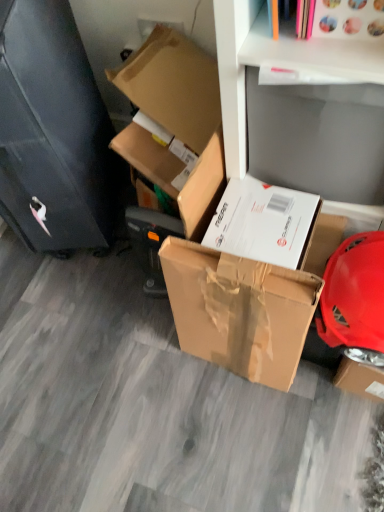
Measure the distance between point [297,68] and camera.

Point [297,68] and camera are 73.10 centimeters apart.

In order to click on black matte file cabinet at left in this screenshot , I will do `click(53, 131)`.

Measure the distance between brown cardboard box at center, which is the 1th box in bottom-to-top order, and camera.

brown cardboard box at center, which is the 1th box in bottom-to-top order, and camera are 30.66 inches apart.

Describe the element at coordinates (177, 119) in the screenshot. I see `brown cardboard box at upper left, positioned as the second box in bottom-to-top order` at that location.

I want to click on white matte shelf at upper center, so click(303, 109).

Are brown cardboard box at upper left, positioned as the second box in bottom-to-top order, and white matte shelf at upper center far apart?

They are positioned close to each other.

Which point is more distant from viewer, (181, 204) or (254, 11)?

Positioned behind is point (181, 204).

Looking at this image, could you tell me if brown cardboard box at upper left, which ranks as the 1th box in top-to-bottom order, is turned towards white matte shelf at upper center?

No, brown cardboard box at upper left, which ranks as the 1th box in top-to-bottom order, is not facing towards white matte shelf at upper center.

Between brown cardboard box at upper left, which ranks as the 1th box in top-to-bottom order, and white matte shelf at upper center, which one has larger size?

brown cardboard box at upper left, which ranks as the 1th box in top-to-bottom order, is bigger.

Is white matte shelf at upper center to the left of brown cardboard box at upper left, which ranks as the 1th box in top-to-bottom order, from the viewer's perspective?

No, white matte shelf at upper center is not to the left of brown cardboard box at upper left, which ranks as the 1th box in top-to-bottom order.

Locate an element on the screen. The image size is (384, 512). the 2nd box counting from the left side of the white matte shelf at upper center is located at coordinates (177, 119).

In the scene shown: Between white matte shelf at upper center and brown cardboard box at upper left, which ranks as the 1th box in top-to-bottom order, which one has smaller width?

Thinner between the two is white matte shelf at upper center.

Between white matte shelf at upper center and brown cardboard box at upper left, which ranks as the 1th box in top-to-bottom order, which one has larger size?

Bigger between the two is brown cardboard box at upper left, which ranks as the 1th box in top-to-bottom order.

Measure the distance from brown cardboard box at center, which is the 1th box in bottom-to-top order, to white matte shelf at upper center.

brown cardboard box at center, which is the 1th box in bottom-to-top order, and white matte shelf at upper center are 11.25 inches apart from each other.

Are brown cardboard box at center, which is the 1th box in bottom-to-top order, and white matte shelf at upper center far apart?

brown cardboard box at center, which is the 1th box in bottom-to-top order, is actually quite close to white matte shelf at upper center.

From the image's perspective, which one is positioned lower, brown cardboard box at center, which is the 1th box in bottom-to-top order, or white matte shelf at upper center?

brown cardboard box at center, which is the 1th box in bottom-to-top order, from the image's perspective.

Looking at this image, is brown cardboard box at center, which is the 1th box in bottom-to-top order, not within white matte shelf at upper center?

Indeed, brown cardboard box at center, which is the 1th box in bottom-to-top order, is completely outside white matte shelf at upper center.

Considering the relative positions of black matte file cabinet at left and brown cardboard box at center, the second box in the top-to-bottom sequence, in the image provided, is black matte file cabinet at left in front of brown cardboard box at center, the second box in the top-to-bottom sequence,?

Yes, the depth of black matte file cabinet at left is less than that of brown cardboard box at center, the second box in the top-to-bottom sequence.

Which of these two, black matte file cabinet at left or brown cardboard box at center, the second box in the top-to-bottom sequence, is smaller?

brown cardboard box at center, the second box in the top-to-bottom sequence.

Who is shorter, black matte file cabinet at left or brown cardboard box at center, which is the 1th box in bottom-to-top order?

brown cardboard box at center, which is the 1th box in bottom-to-top order, is shorter.

Is black matte file cabinet at left positioned with its back to brown cardboard box at center, the second box in the top-to-bottom sequence?

black matte file cabinet at left is not turned away from brown cardboard box at center, the second box in the top-to-bottom sequence.

Which object is thinner, brown cardboard box at upper left, positioned as the second box in bottom-to-top order, or black matte file cabinet at left?

With smaller width is black matte file cabinet at left.

Based on the photo, is brown cardboard box at upper left, positioned as the second box in bottom-to-top order, touching black matte file cabinet at left?

No.

Is brown cardboard box at upper left, positioned as the second box in bottom-to-top order, inside the boundaries of black matte file cabinet at left, or outside?

brown cardboard box at upper left, positioned as the second box in bottom-to-top order, is outside black matte file cabinet at left.

From the image's perspective, is brown cardboard box at upper left, which ranks as the 1th box in top-to-bottom order, located above brown cardboard box at center, which is the 1th box in bottom-to-top order?

Yes.

Is brown cardboard box at upper left, which ranks as the 1th box in top-to-bottom order, positioned with its back to brown cardboard box at center, which is the 1th box in bottom-to-top order?

No, brown cardboard box at center, which is the 1th box in bottom-to-top order, is not at the back of brown cardboard box at upper left, which ranks as the 1th box in top-to-bottom order.

Is point (183, 200) farther from viewer compared to point (208, 302)?

No, it is in front of (208, 302).

Which is closer to the camera, (58, 145) or (250, 51)?

Point (58, 145).

Can white matte shelf at upper center be found inside black matte file cabinet at left?

No, white matte shelf at upper center is not surrounded by black matte file cabinet at left.

From the image's perspective, is black matte file cabinet at left above white matte shelf at upper center?

Correct, black matte file cabinet at left appears higher than white matte shelf at upper center in the image.

Based on the photo, is black matte file cabinet at left bigger or smaller than white matte shelf at upper center?

In the image, black matte file cabinet at left appears to be larger than white matte shelf at upper center.

Image resolution: width=384 pixels, height=512 pixels. Find the location of `shelf above the brown cardboard box at upper left, positioned as the second box in bottom-to-top order (from a real-world perspective)`. shelf above the brown cardboard box at upper left, positioned as the second box in bottom-to-top order (from a real-world perspective) is located at coordinates (303, 109).

In the image, there is a white matte shelf at upper center. Identify the location of box above it (from the image's perspective). The image size is (384, 512). (177, 119).

When comparing their distances from white matte shelf at upper center, does brown cardboard box at upper left, positioned as the second box in bottom-to-top order, or brown cardboard box at center, the second box in the top-to-bottom sequence, seem further?

brown cardboard box at center, the second box in the top-to-bottom sequence, lies further to white matte shelf at upper center than the other object.

Estimate the real-world distances between objects in this image. Which object is further from white matte shelf at upper center, brown cardboard box at center, the second box in the top-to-bottom sequence, or black matte file cabinet at left?

black matte file cabinet at left is further to white matte shelf at upper center.

When comparing their distances from brown cardboard box at center, which is the 1th box in bottom-to-top order, does white matte shelf at upper center or black matte file cabinet at left seem closer?

white matte shelf at upper center is positioned closer to the anchor brown cardboard box at center, which is the 1th box in bottom-to-top order.

When comparing their distances from brown cardboard box at upper left, positioned as the second box in bottom-to-top order, does brown cardboard box at center, the second box in the top-to-bottom sequence, or black matte file cabinet at left seem further?

brown cardboard box at center, the second box in the top-to-bottom sequence, is further to brown cardboard box at upper left, positioned as the second box in bottom-to-top order.

Based on their spatial positions, is black matte file cabinet at left or white matte shelf at upper center closer to brown cardboard box at center, the second box in the top-to-bottom sequence?

white matte shelf at upper center.

Based on the photo, based on their spatial positions, is brown cardboard box at upper left, positioned as the second box in bottom-to-top order, or brown cardboard box at center, the second box in the top-to-bottom sequence, closer to black matte file cabinet at left?

Based on the image, brown cardboard box at upper left, positioned as the second box in bottom-to-top order, appears to be nearer to black matte file cabinet at left.

Which object lies further to the anchor point white matte shelf at upper center, black matte file cabinet at left or brown cardboard box at upper left, positioned as the second box in bottom-to-top order?

Among the two, black matte file cabinet at left is located further to white matte shelf at upper center.

Based on their spatial positions, is black matte file cabinet at left or white matte shelf at upper center closer to brown cardboard box at upper left, positioned as the second box in bottom-to-top order?

white matte shelf at upper center is closer to brown cardboard box at upper left, positioned as the second box in bottom-to-top order.

At what (x,y) coordinates should I click in order to perform the action: click on shelf between brown cardboard box at upper left, which ranks as the 1th box in top-to-bottom order, and brown cardboard box at center, which is the 1th box in bottom-to-top order, from top to bottom. Please return your answer as a coordinate pair (x, y). Looking at the image, I should click on (303, 109).

Locate an element on the screen. box between black matte file cabinet at left and brown cardboard box at center, which is the 1th box in bottom-to-top order, vertically is located at coordinates (177, 119).